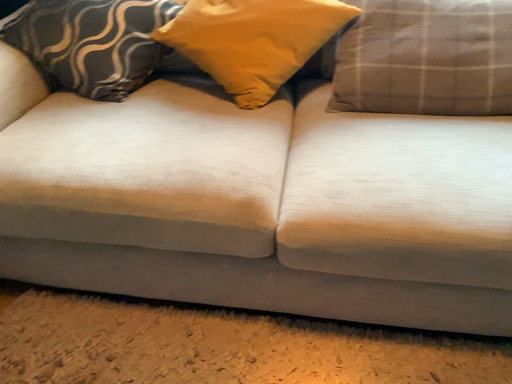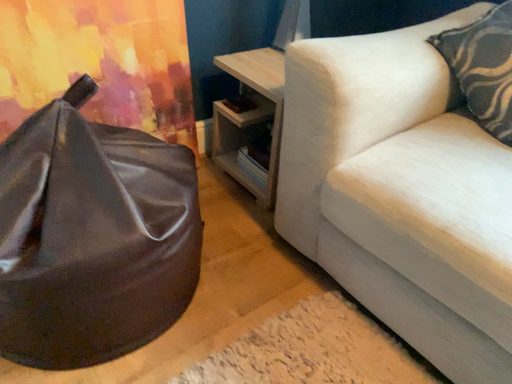
Question: Which way did the camera rotate in the video?

Choices:
 (A) rotated right
 (B) rotated left

Answer: (B)